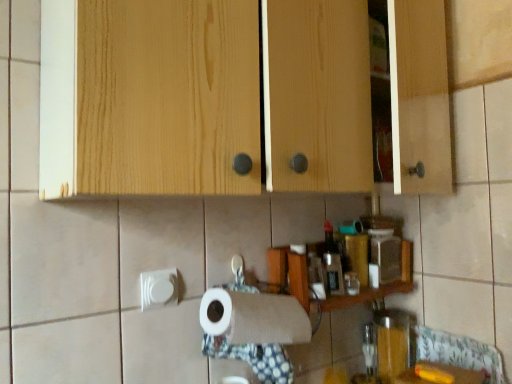
Question: Based on their positions, is smooth wooden counter at lower right located to the left or right of natural wood cabinet at upper center?

Choices:
 (A) left
 (B) right

Answer: (B)

Question: From their relative heights in the image, would you say smooth wooden counter at lower right is taller or shorter than natural wood cabinet at upper center?

Choices:
 (A) tall
 (B) short

Answer: (B)

Question: Estimate the real-world distances between objects in this image. Which object is farther from the wooden shelf at center?

Choices:
 (A) natural wood cabinet at upper center
 (B) translucent glass jar at lower right
 (C) smooth wooden counter at lower right

Answer: (A)

Question: Estimate the real-world distances between objects in this image. Which object is closer to the smooth wooden counter at lower right?

Choices:
 (A) natural wood cabinet at upper center
 (B) wooden shelf at center
 (C) translucent glass jar at lower right

Answer: (C)